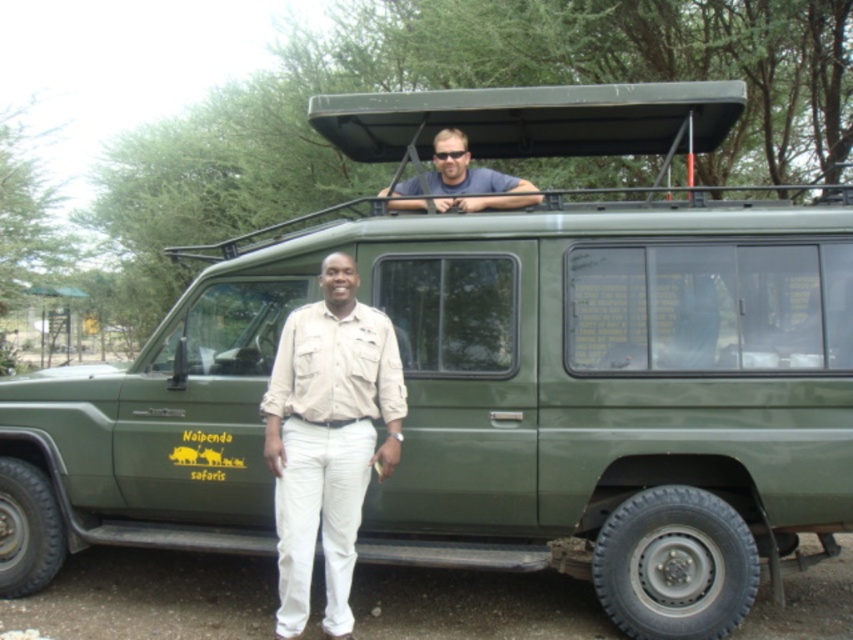
You are a tourist looking at the two people next to the safari vehicle. Which person is wearing the khaki fabric shirt at center and is positioned lower than the matte blue shirt at upper center?

The khaki fabric shirt at center is below the matte blue shirt at upper center, so the person wearing the khaki fabric shirt at center is positioned lower than the person in the matte blue shirt at upper center.

You are a photographer trying to capture both the khaki fabric shirt at center and the matte blue shirt at upper center in a single frame. Based on their sizes, which shirt would appear smaller in the photo?

The khaki fabric shirt at center appears smaller in the photo because it has a lesser width compared to the matte blue shirt at upper center.

Looking at this image, you are a photographer trying to capture the best angle of the safari vehicle. You notice two specific points marked on the vehicle. Which point is closer to your camera lens? The points are point 1 at coordinates point (329, 609) and point 2 at coordinates point (445, 134).

Point 1 at coordinates point (329, 609) is closer to the viewer, so it will appear closer to your camera lens.